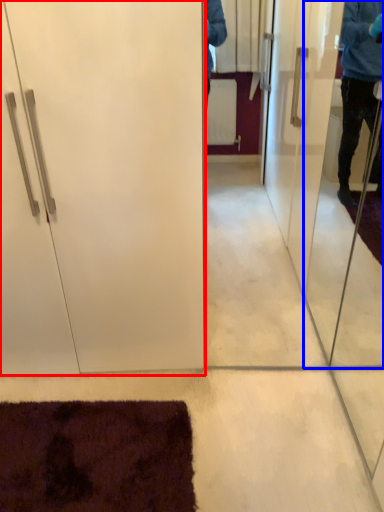
Question: Which of the following is the farthest to the observer, door (highlighted by a red box) or screen door (highlighted by a blue box)?

Choices:
 (A) door
 (B) screen door

Answer: (A)